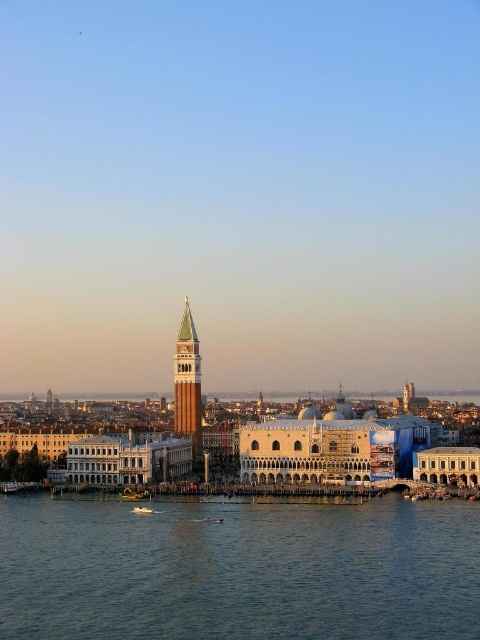
Does point (200, 380) come farther from viewer compared to point (135, 506)?

That is True.

Image resolution: width=480 pixels, height=640 pixels. Find the location of `green glass bell tower at center`. green glass bell tower at center is located at coordinates (188, 381).

In the scene shown: Can you confirm if blue water at lower center is positioned above white glossy boat at lower center?

Indeed, blue water at lower center is positioned over white glossy boat at lower center.

Between point (3, 502) and point (154, 513), which one is positioned behind?

The point (3, 502) is more distant.

In the scene shown: Who is more distant from viewer, (300, 557) or (146, 509)?

The point (146, 509) is more distant.

Find the location of a particular element. The width and height of the screenshot is (480, 640). blue water at lower center is located at coordinates (239, 570).

Does blue water at lower center have a lesser height compared to green glass bell tower at center?

Yes.

Can you confirm if blue water at lower center is positioned below green glass bell tower at center?

Yes.

Which is in front, point (92, 561) or point (184, 323)?

Point (92, 561)

Image resolution: width=480 pixels, height=640 pixels. Find the location of `blue water at lower center`. blue water at lower center is located at coordinates (239, 570).